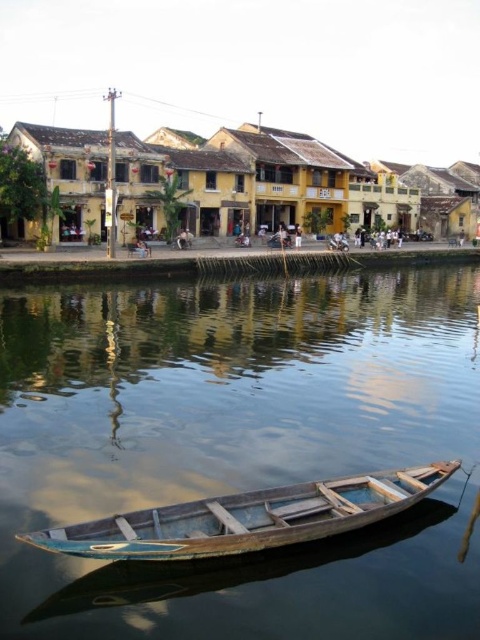
You are a fisherman who wants to navigate your wooden boat at lower center through the smooth dark blue water at center to reach the opposite bank. Based on the width of the water and the boat, can you safely maneuver the boat without getting stuck?

The smooth dark blue water at center might be wider than wooden boat at lower center, so there is a possibility that the boat can safely navigate through the water without getting stuck, but there is uncertainty due to the comparative width not being definitively stated.

You are standing on the riverside and see the smooth dark blue water at center and the wooden boat at lower center. Which object is closer to your viewpoint?

The wooden boat at lower center is closer to your viewpoint because it is positioned below the smooth dark blue water at center, which is above it.